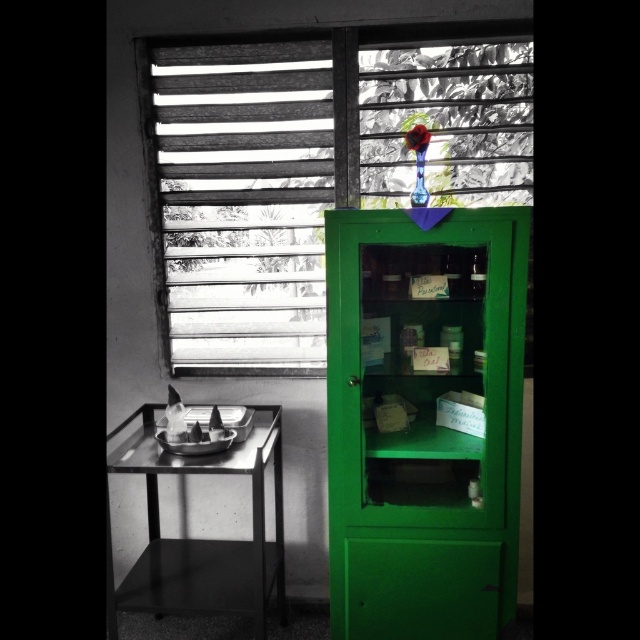
You are standing in the room and want to move from the point at coordinates point (342, 93) to the point at coordinates point (205, 548). According to the scene description, which direction should you move to get closer to your destination?

To move from point (342, 93) to point (205, 548), you should move towards the right and downward since point (205, 548) is located to the right and lower than point (342, 93) in the scene.